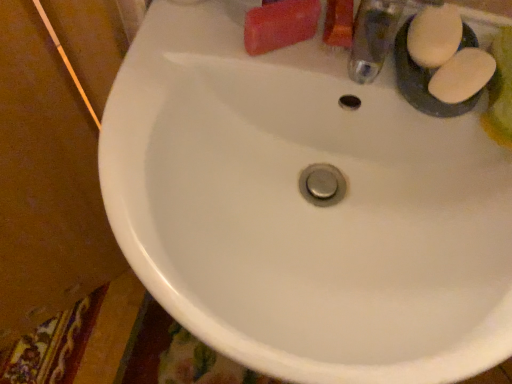
Locate an element on the screen. free space to the left of white matte soap at upper right, which is the 2th soap in left-to-right order is located at coordinates (261, 51).